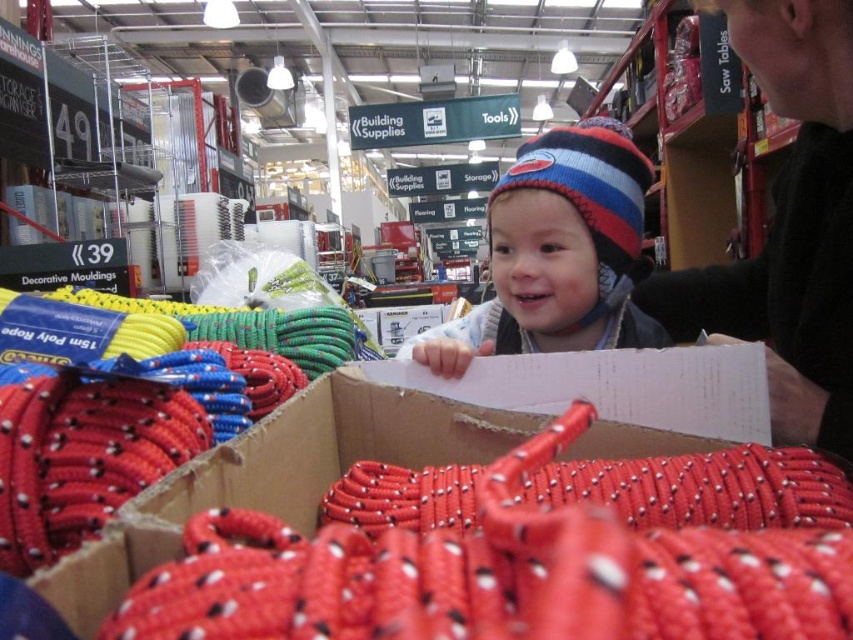
You are a store employee who needs to place a new tag between the black sweater at upper right and the striped knit hat at upper center. The tag requires 10 inches of space to be placed properly. Can you fit the tag between them?

The black sweater at upper right is only 8.25 inches away from the striped knit hat at upper center, which is less than the required 10 inches. Therefore, the tag cannot be placed between them properly.

You are a store employee organizing the winter clothing section. You have a black sweater at upper right and a striped knit hat at upper center. Which item has a smaller width?

The black sweater at upper right has a smaller width than the striped knit hat at upper center.